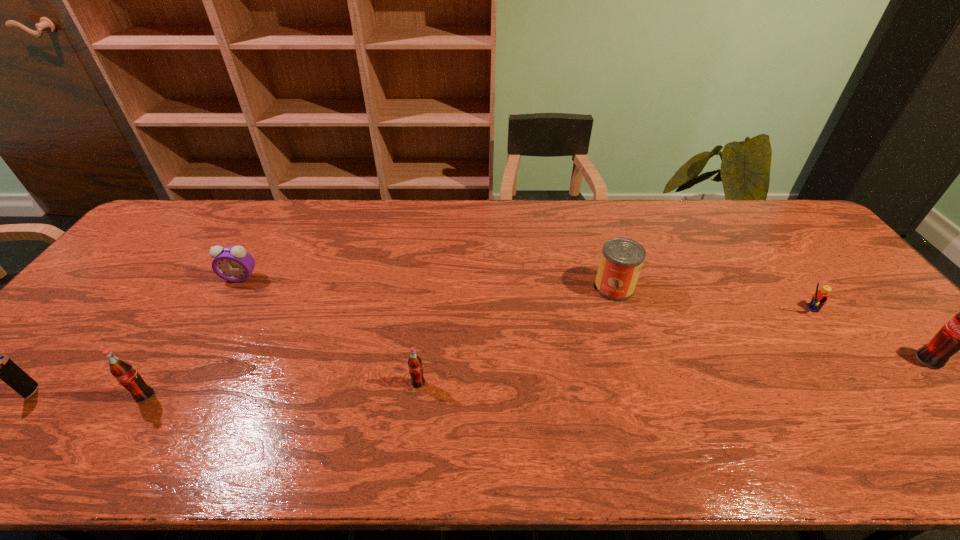
Locate an element on the screen. This screenshot has width=960, height=540. vacant position for inserting another pop_(soda) evenly is located at coordinates (679, 372).